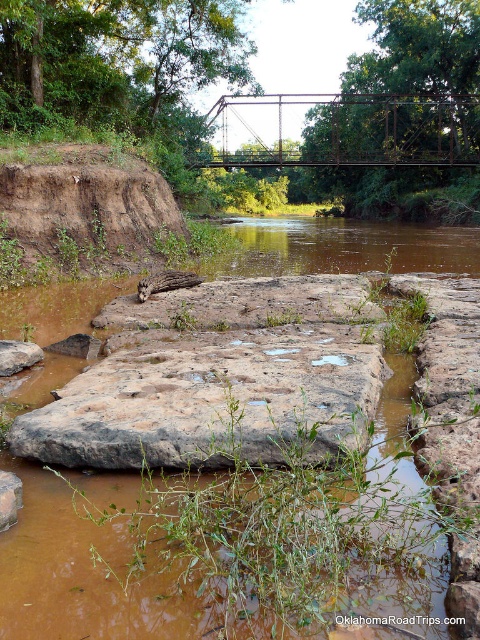
Question: Is brown muddy water at center to the right of brown rough rock at lower left from the viewer's perspective?

Choices:
 (A) yes
 (B) no

Answer: (A)

Question: Is brown rough rock at center positioned before rusty metal bridge at upper center?

Choices:
 (A) no
 (B) yes

Answer: (B)

Question: Is brown rough rock at center bigger than brown rough rock at lower left?

Choices:
 (A) no
 (B) yes

Answer: (B)

Question: Which object is farther from the camera taking this photo?

Choices:
 (A) brown rough rock at lower left
 (B) brown rough rock at center
 (C) rusty metal bridge at upper center
 (D) brown muddy water at center

Answer: (C)

Question: Which object is the farthest from the brown muddy water at center?

Choices:
 (A) rusty metal bridge at upper center
 (B) brown rough rock at center
 (C) brown rough rock at lower left

Answer: (A)

Question: Which of these objects is positioned farthest from the rusty metal bridge at upper center?

Choices:
 (A) brown rough rock at lower left
 (B) brown muddy water at center
 (C) brown rough rock at center

Answer: (A)